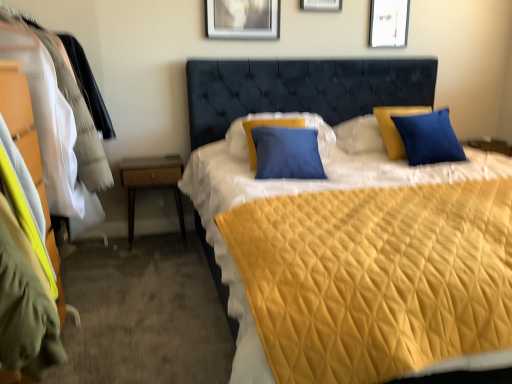
Question: From the image's perspective, is blue matte pillow at center located beneath matte silver picture frame at upper center, which ranks as the 2th picture frame in right-to-left order?

Choices:
 (A) yes
 (B) no

Answer: (A)

Question: Is blue matte pillow at center taller than matte silver picture frame at upper center, which ranks as the 2th picture frame in right-to-left order?

Choices:
 (A) no
 (B) yes

Answer: (B)

Question: Considering the relative sizes of blue matte pillow at center and matte silver picture frame at upper center, which ranks as the 2th picture frame in right-to-left order, in the image provided, is blue matte pillow at center shorter than matte silver picture frame at upper center, which ranks as the 2th picture frame in right-to-left order,?

Choices:
 (A) yes
 (B) no

Answer: (B)

Question: Is blue matte pillow at center oriented away from matte silver picture frame at upper center, arranged as the 2th picture frame when viewed from the left?

Choices:
 (A) no
 (B) yes

Answer: (A)

Question: Does blue matte pillow at center contain matte silver picture frame at upper center, arranged as the 2th picture frame when viewed from the left?

Choices:
 (A) yes
 (B) no

Answer: (B)

Question: Based on their positions, is blue matte pillow at center located to the left or right of matte silver picture frame at upper center, arranged as the 2th picture frame when viewed from the left?

Choices:
 (A) left
 (B) right

Answer: (A)

Question: From a real-world perspective, is blue matte pillow at center physically located above or below matte silver picture frame at upper center, arranged as the 2th picture frame when viewed from the left?

Choices:
 (A) above
 (B) below

Answer: (B)

Question: Is point (291, 114) closer or farther from the camera than point (339, 4)?

Choices:
 (A) closer
 (B) farther

Answer: (A)

Question: Based on their sizes in the image, would you say blue matte pillow at center is bigger or smaller than matte silver picture frame at upper center, which ranks as the 2th picture frame in right-to-left order?

Choices:
 (A) big
 (B) small

Answer: (A)

Question: From a real-world perspective, is matte wood dresser at left above or below wooden nightstand at lower left?

Choices:
 (A) below
 (B) above

Answer: (B)

Question: In the image, is matte wood dresser at left positioned in front of or behind wooden nightstand at lower left?

Choices:
 (A) behind
 (B) front

Answer: (B)

Question: Is matte wood dresser at left bigger or smaller than wooden nightstand at lower left?

Choices:
 (A) big
 (B) small

Answer: (A)

Question: Is matte wood dresser at left inside or outside of wooden nightstand at lower left?

Choices:
 (A) inside
 (B) outside

Answer: (B)

Question: Considering the positions of matte wood dresser at left and white paper at upper center, positioned as the 1th picture frame in right-to-left order, in the image, is matte wood dresser at left taller or shorter than white paper at upper center, positioned as the 1th picture frame in right-to-left order,?

Choices:
 (A) short
 (B) tall

Answer: (B)

Question: From the image's perspective, is matte wood dresser at left positioned above or below white paper at upper center, which is the 3th picture frame in left-to-right order?

Choices:
 (A) above
 (B) below

Answer: (B)